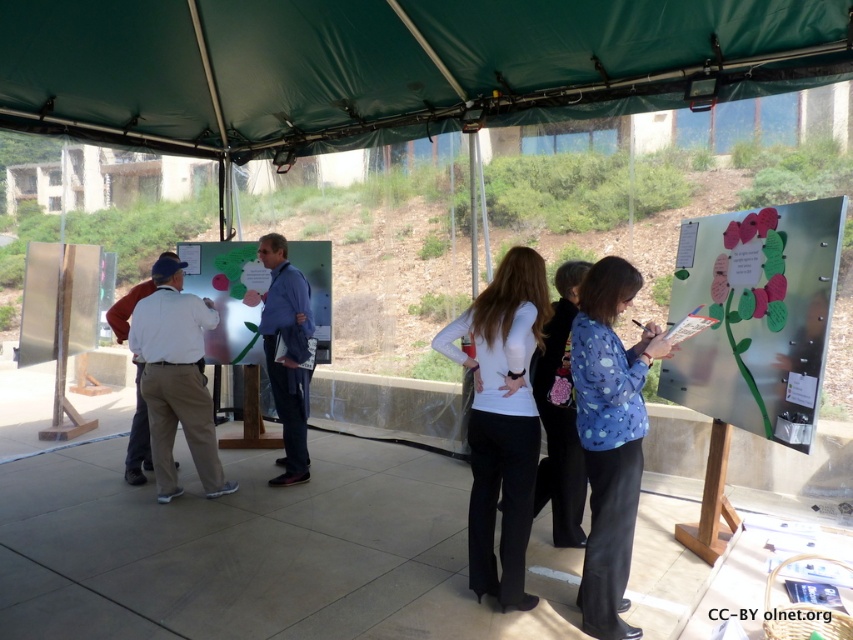
Question: Among these objects, which one is farthest from the camera?

Choices:
 (A) white matte shirt at center
 (B) blue dotted shirt at center
 (C) blue shirt at center
 (D) white shirt at left

Answer: (C)

Question: Is green fabric canopy at upper center bigger than white matte shirt at center?

Choices:
 (A) no
 (B) yes

Answer: (B)

Question: Is metallic flower at right to the left of matte white board at center from the viewer's perspective?

Choices:
 (A) no
 (B) yes

Answer: (A)

Question: Which object is the farthest from the green fabric canopy at upper center?

Choices:
 (A) white matte shirt at center
 (B) metallic flower at right
 (C) blue fabric jacket at center

Answer: (A)

Question: Is metallic flower at right below blue fabric jacket at center?

Choices:
 (A) no
 (B) yes

Answer: (A)

Question: Which point is closer to the camera?

Choices:
 (A) (509, 504)
 (B) (112, 305)
 (C) (573, 353)
 (D) (734, 221)

Answer: (C)